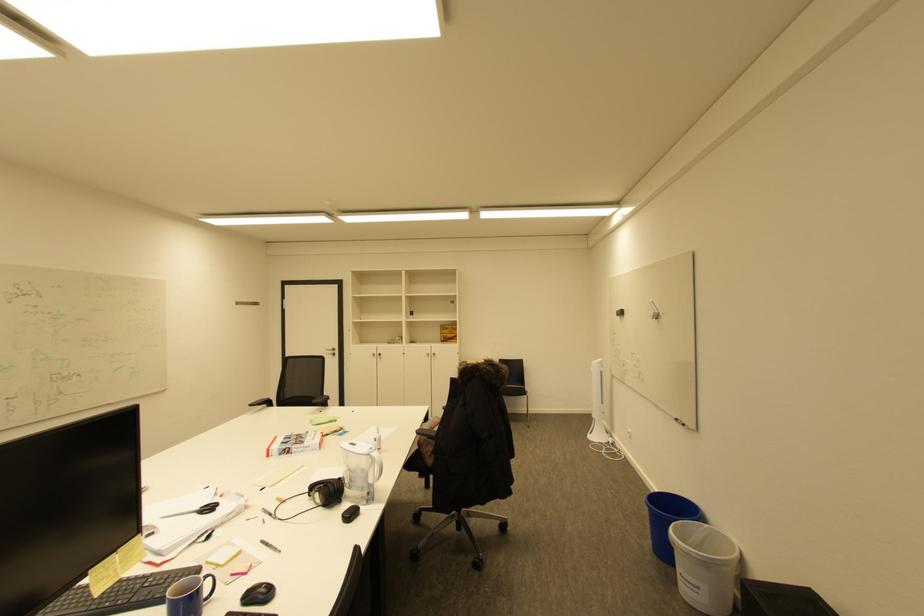
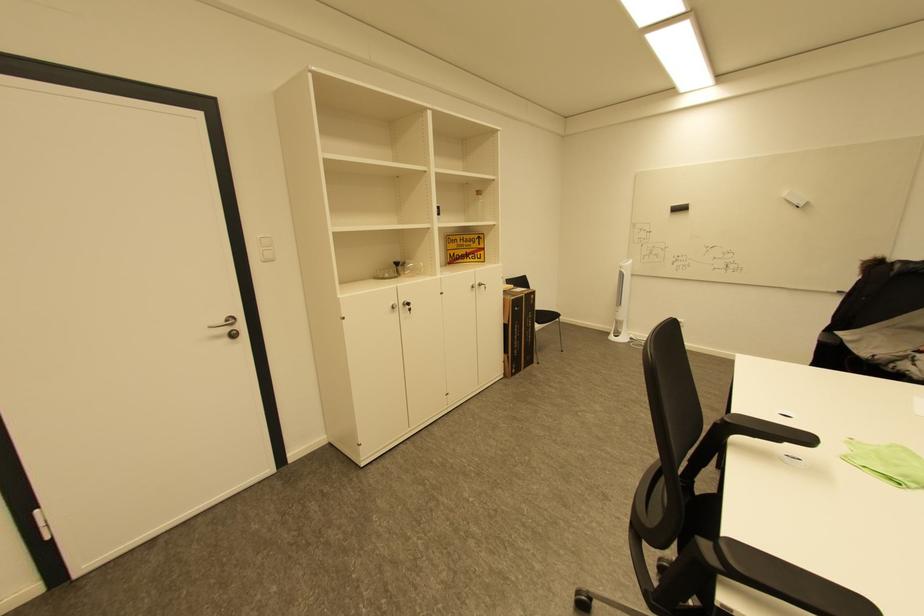
In the second image, find the point that corresponds to [380,355] in the first image.

(398, 308)